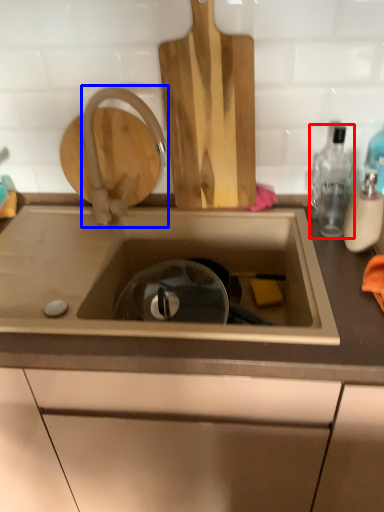
Question: Which object appears farthest to the camera in this image, bottle (highlighted by a red box) or tap (highlighted by a blue box)?

Choices:
 (A) bottle
 (B) tap

Answer: (B)